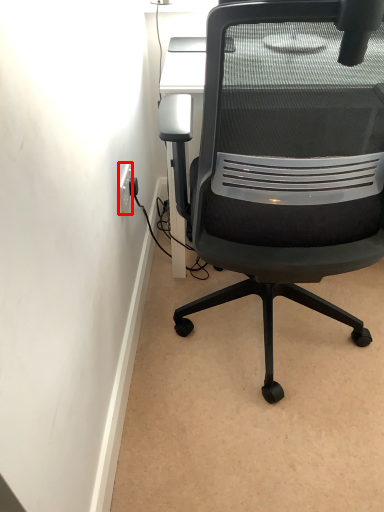
Question: Considering the relative positions of electric outlet (annotated by the red box) and chair in the image provided, where is electric outlet (annotated by the red box) located with respect to the staircase?

Choices:
 (A) right
 (B) left

Answer: (B)